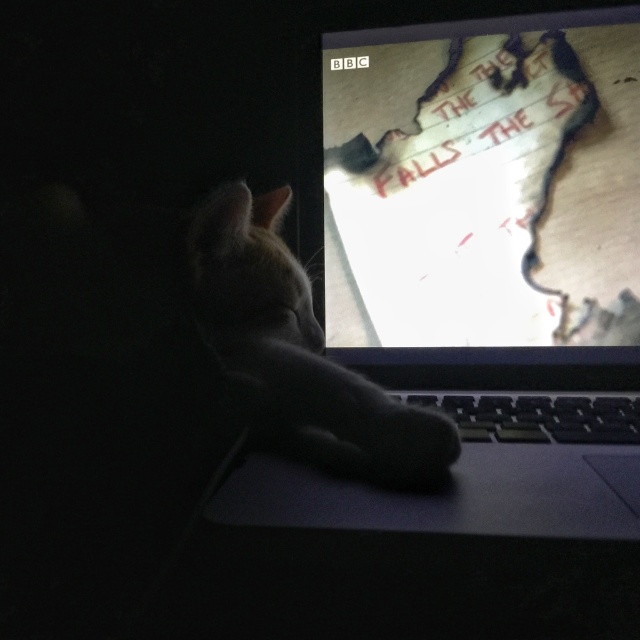
Question: Among these points, which one is nearest to the camera?

Choices:
 (A) (401, 228)
 (B) (509, 132)
 (C) (554, 401)
 (D) (435, 426)

Answer: (D)

Question: Does white paper at center have a lesser width compared to black fuzzy paw at lower center?

Choices:
 (A) yes
 (B) no

Answer: (B)

Question: Which of the following is the farthest from the observer?

Choices:
 (A) slate gray laptop at center
 (B) black plastic keyboard at center

Answer: (B)

Question: Is white fur cat at center wider than black fuzzy paw at lower center?

Choices:
 (A) yes
 (B) no

Answer: (A)

Question: Does white paper at center have a greater width compared to black fuzzy paw at lower center?

Choices:
 (A) yes
 (B) no

Answer: (A)

Question: Based on their relative distances, which object is nearer to the black plastic keyboard at center?

Choices:
 (A) black fuzzy paw at lower center
 (B) slate gray laptop at center

Answer: (B)